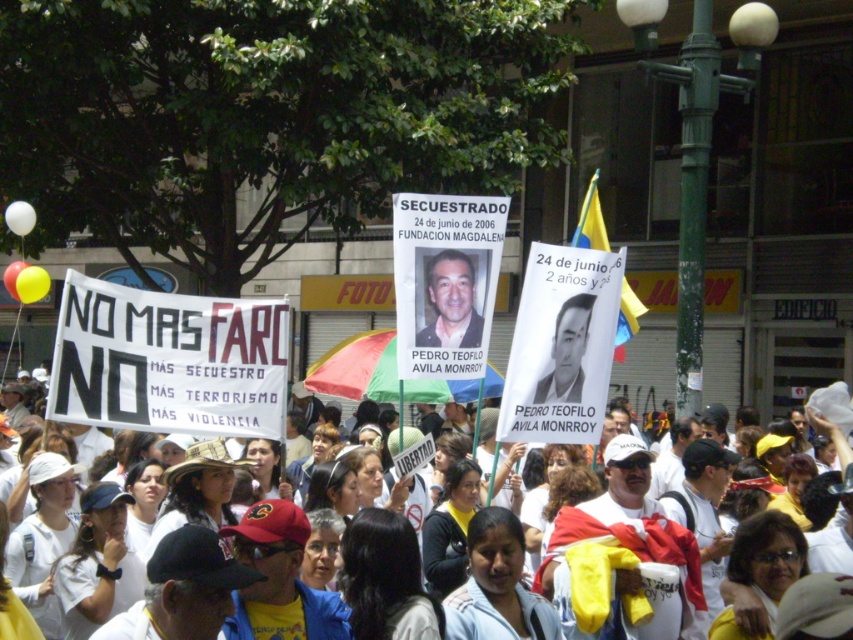
Based on the photo, you are a journalist at the demonstration and want to take a photo of both the matte black photo at center and the white paper sign at center. Which object should you adjust your camera focus to capture first?

The matte black photo at center is closer to you than the white paper sign at center, so adjust your camera focus to capture the matte black photo at center first.